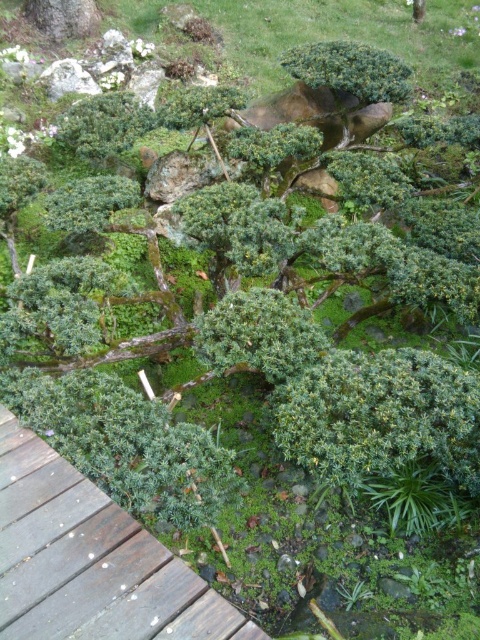
You are a gardener who needs to water the green matte bush at upper center. To reach it, you must walk along the brown wooden path at lower left. Will the path lead you directly to the bush?

Yes, the brown wooden path at lower left is in front of the green matte bush at upper center, so walking along the path will lead you directly to the bush.

You are standing in the bonsai garden and want to take a closer look at the point marked at coordinate point (88, 545). If you move forward 3 feet, will you reach that point?

The point at coordinate point (88, 545) is 4.78 feet away from the camera. Moving forward 3 feet would leave you 1.78 feet away from the point, so you have not yet reached it.

You are a gardener planning to place a new decorative stone at the exact center of the bonsai garden. Given the current layout, where should you place it relative to the green leafy bush at center?

The green leafy bush at center is already located at the exact center point of the bonsai garden at coordinates (380, 417), so placing the decorative stone there would position it at the center.